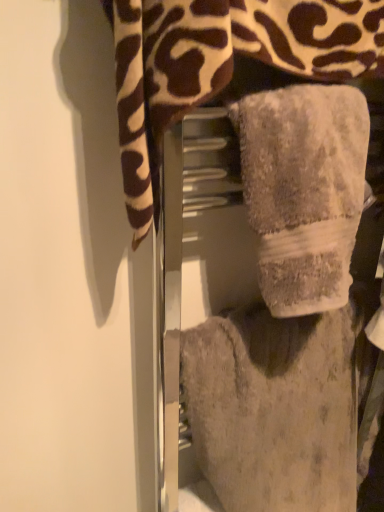
Question: Is fuzzy gray towel at center, which ranks as the 1th towel in bottom-to-top order, inside or outside of gray plush towel at center, the 3th towel when ordered from bottom to top?

Choices:
 (A) outside
 (B) inside

Answer: (A)

Question: From the image's perspective, is fuzzy gray towel at center, the 3th towel viewed from the top, above or below gray plush towel at center, the 3th towel when ordered from bottom to top?

Choices:
 (A) above
 (B) below

Answer: (B)

Question: Which is farther from the gray plush towel at center, the 3th towel when ordered from bottom to top?

Choices:
 (A) fuzzy gray towel at center, the 3th towel viewed from the top
 (B) gray fluffy towel at center, marked as the 2th towel in a top-to-bottom arrangement

Answer: (A)

Question: Which object is positioned farthest from the gray plush towel at center, positioned as the 1th towel in top-to-bottom order?

Choices:
 (A) fuzzy gray towel at center, which ranks as the 1th towel in bottom-to-top order
 (B) gray fluffy towel at center, marked as the 2th towel in a top-to-bottom arrangement

Answer: (A)